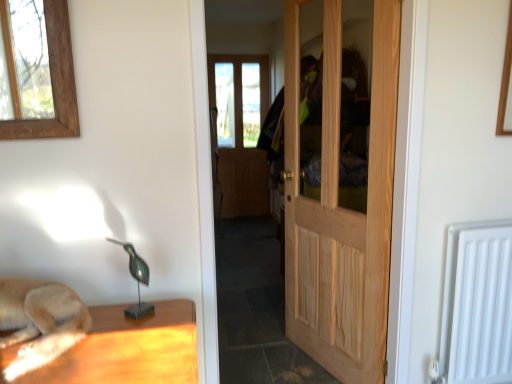
The height and width of the screenshot is (384, 512). Describe the element at coordinates (477, 304) in the screenshot. I see `white matte radiator at lower right` at that location.

Image resolution: width=512 pixels, height=384 pixels. In order to click on white matte radiator at lower right in this screenshot , I will do `click(477, 304)`.

What is the approximate width of green metallic bird at center?

It is 4.59 inches.

Image resolution: width=512 pixels, height=384 pixels. In order to click on natural wood door at center in this screenshot , I will do `click(340, 181)`.

Locate an element on the screen. white matte radiator at lower right is located at coordinates (477, 304).

Is white matte radiator at lower right surrounded by natural wood door at center?

No, white matte radiator at lower right is not surrounded by natural wood door at center.

Which of these two, natural wood door at center or white matte radiator at lower right, is smaller?

With smaller size is white matte radiator at lower right.

Considering their positions, is natural wood door at center located in front of or behind white matte radiator at lower right?

natural wood door at center is in front of white matte radiator at lower right.

From a real-world perspective, relative to natural wood door at center, is white matte radiator at lower right vertically above or below?

white matte radiator at lower right is below natural wood door at center.

Considering the sizes of objects white matte radiator at lower right and natural wood door at center in the image provided, who is smaller, white matte radiator at lower right or natural wood door at center?

white matte radiator at lower right is smaller.

Can natural wood door at center be found inside white matte radiator at lower right?

No, natural wood door at center is not a part of white matte radiator at lower right.

Based on the photo, is white matte radiator at lower right oriented away from natural wood door at center?

That's not correct — white matte radiator at lower right is not looking away from natural wood door at center.

Does white matte radiator at lower right lie behind green metallic bird at center?

Yes, white matte radiator at lower right is further from the viewer.

Is there a large distance between white matte radiator at lower right and green metallic bird at center?

white matte radiator at lower right is far away from green metallic bird at center.

Is white matte radiator at lower right spatially inside green metallic bird at center, or outside of it?

white matte radiator at lower right exists outside the volume of green metallic bird at center.

Is white matte radiator at lower right smaller than green metallic bird at center?

No, white matte radiator at lower right is not smaller than green metallic bird at center.

Between green metallic bird at center and white matte radiator at lower right, which one has larger size?

white matte radiator at lower right is bigger.

Is green metallic bird at center completely or partially outside of white matte radiator at lower right?

green metallic bird at center lies outside white matte radiator at lower right's area.

Does green metallic bird at center appear on the left side of white matte radiator at lower right?

Yes.

Between point (146, 315) and point (482, 350), which one is positioned in front?

Point (146, 315)

Where is `door located above the green metallic bird at center (from a real-world perspective)`? door located above the green metallic bird at center (from a real-world perspective) is located at coordinates (340, 181).

Considering the positions of objects green metallic bird at center and natural wood door at center in the image provided, who is behind, green metallic bird at center or natural wood door at center?

Positioned behind is natural wood door at center.

In the scene shown: What's the angular difference between green metallic bird at center and natural wood door at center's facing directions?

The facing directions of green metallic bird at center and natural wood door at center are 69.6 degrees apart.

Is green metallic bird at center not inside natural wood door at center?

That's correct, green metallic bird at center is outside of natural wood door at center.

Which of these two, natural wood door at center or green metallic bird at center, is smaller?

Smaller between the two is green metallic bird at center.

Is natural wood door at center directly adjacent to green metallic bird at center?

No, natural wood door at center is not with green metallic bird at center.

Looking at this image, which of these two, natural wood door at center or green metallic bird at center, is wider?

natural wood door at center.

Is natural wood door at center completely or partially outside of green metallic bird at center?

natural wood door at center is positioned outside green metallic bird at center.

You are a GUI agent. You are given a task and a screenshot of the screen. Output one action in this format:
    pyautogui.click(x=<x>, y=<y>)
    Task: Click on the radiator that appears below the natural wood door at center (from the image's perspective)
    
    Given the screenshot: What is the action you would take?
    pyautogui.click(x=477, y=304)

Find the location of `door in front of the white matte radiator at lower right`. door in front of the white matte radiator at lower right is located at coordinates (340, 181).

Considering their positions, is natural wood door at center positioned closer to white matte radiator at lower right than green metallic bird at center?

natural wood door at center.

Based on their spatial positions, is natural wood door at center or white matte radiator at lower right closer to green metallic bird at center?

natural wood door at center.

When comparing their distances from natural wood door at center, does white matte radiator at lower right or green metallic bird at center seem further?

Based on the image, green metallic bird at center appears to be further to natural wood door at center.

When comparing their distances from green metallic bird at center, does white matte radiator at lower right or natural wood door at center seem further?

white matte radiator at lower right.

Looking at the image, which one is located further to white matte radiator at lower right, green metallic bird at center or natural wood door at center?

Based on the image, green metallic bird at center appears to be further to white matte radiator at lower right.

From the picture: Looking at the image, which one is located further to natural wood door at center, green metallic bird at center or white matte radiator at lower right?

The object further to natural wood door at center is green metallic bird at center.

You are a GUI agent. You are given a task and a screenshot of the screen. Output one action in this format:
    pyautogui.click(x=<x>, y=<y>)
    Task: Click on the door between green metallic bird at center and white matte radiator at lower right
    The width and height of the screenshot is (512, 384).
    Given the screenshot: What is the action you would take?
    pyautogui.click(x=340, y=181)